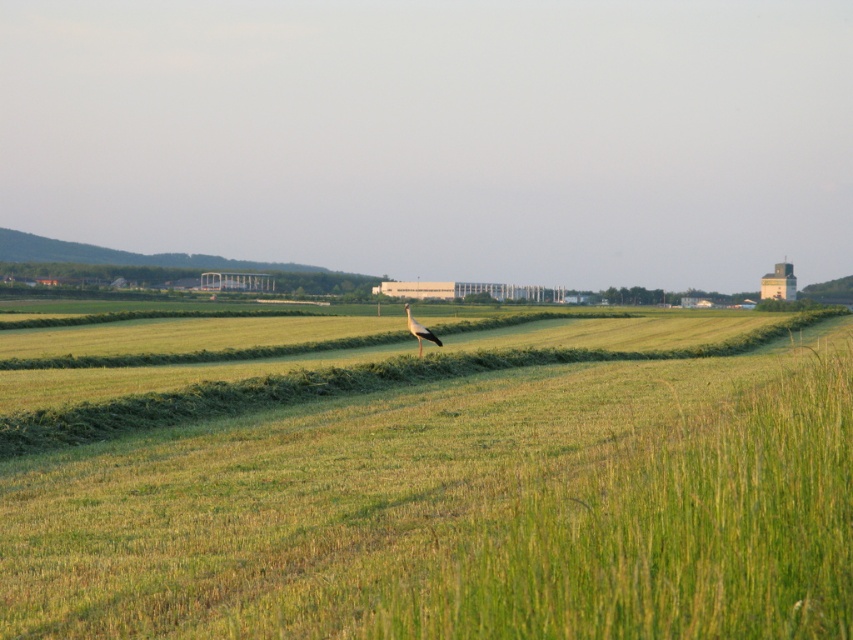
You are standing in the middle of the green grassy field at center and want to approach the white feathered bird at center. Which direction should you move to get closer to the bird?

Since the green grassy field at center is closer to the viewer than the white feathered bird at center, you should move forward towards the bird as it is further away in the midground.

You are standing in the middle of a field and see two points in the distance. One is at point (x=395, y=572) and the other is at point (x=436, y=342). Which point is closer to you?

Point (x=395, y=572) is closer to the viewer than point (x=436, y=342).

You are a drone operator tasked with capturing aerial footage of the green grassy field at center. Based on the coordinates provided, can you confirm if the field is positioned towards the upper or lower half of the image?

The green grassy field at center is located at point coordinates with a y value of 0.539, which places it in the lower half of the image since the y value is closer to 1.0 than 0.0.